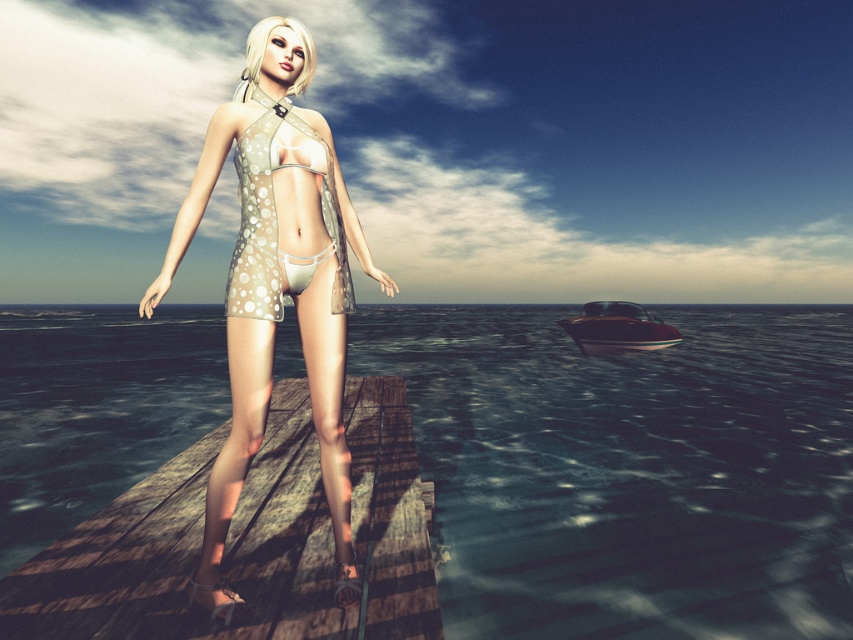
Between matte beige swimsuit at center and beige dotted fabric bikini at center, which one has more height?

With more height is matte beige swimsuit at center.

Does matte beige swimsuit at center appear over beige dotted fabric bikini at center?

Incorrect, matte beige swimsuit at center is not positioned above beige dotted fabric bikini at center.

Does point (206, 193) come closer to viewer compared to point (258, 140)?

No, it is not.

Identify the location of matte beige swimsuit at center. The height and width of the screenshot is (640, 853). (276, 285).

Is translucent blue water at center below matte beige swimsuit at center?

Yes, translucent blue water at center is below matte beige swimsuit at center.

Who is positioned more to the left, translucent blue water at center or matte beige swimsuit at center?

translucent blue water at center is more to the left.

At what (x,y) coordinates should I click in order to perform the action: click on translucent blue water at center. Please return your answer as a coordinate pair (x, y). The image size is (853, 640). Looking at the image, I should click on (630, 468).

Locate an element on the screen. translucent blue water at center is located at coordinates point(630,468).

Does wooden planks at center appear over shiny brown wooden boat at lower right?

No, wooden planks at center is not above shiny brown wooden boat at lower right.

Find the location of `wooden planks at center`. wooden planks at center is located at coordinates (248, 540).

Locate an element on the screen. wooden planks at center is located at coordinates (248, 540).